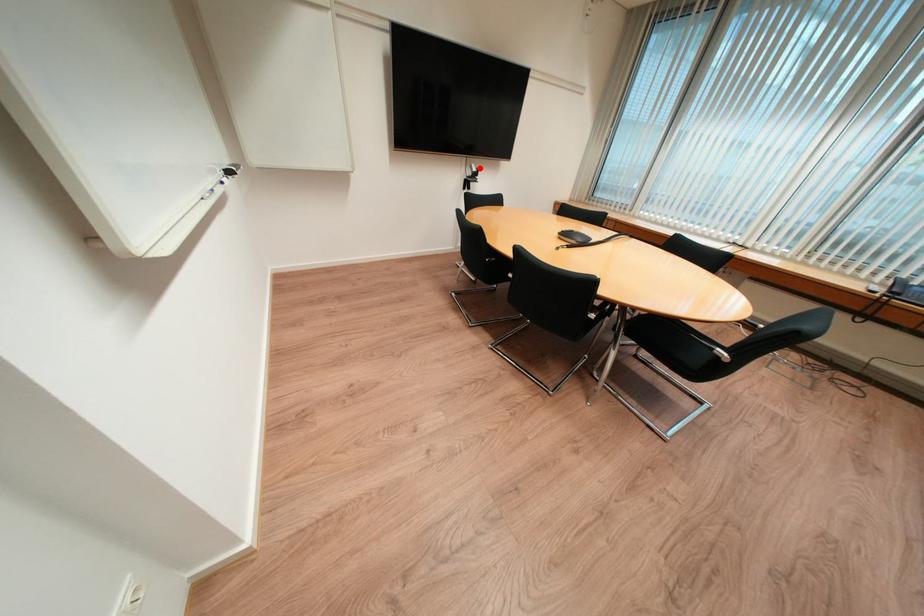
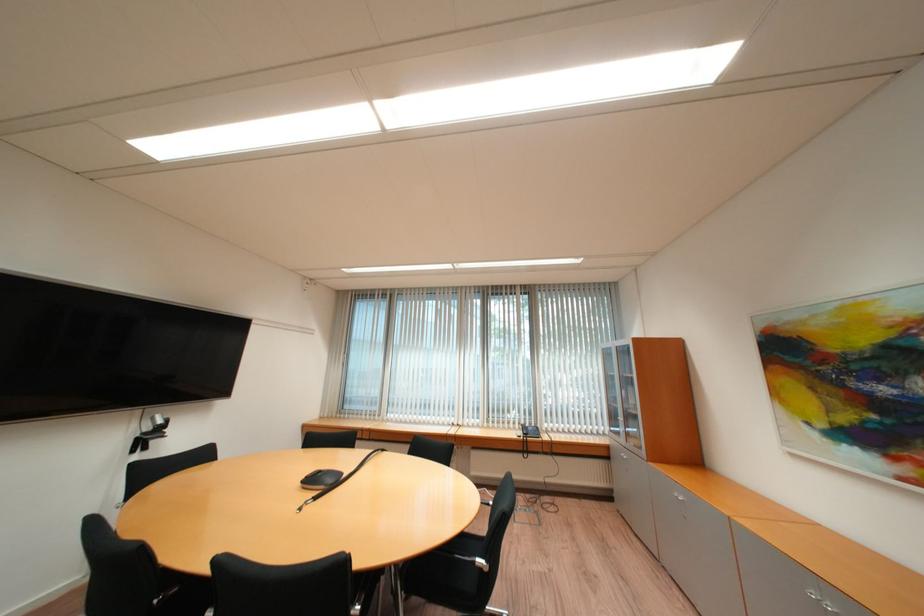
Question: I am providing you with two images of the same scene from different viewpoints. A red point is shown in image1. For the corresponding object point in image2, is it positioned nearer or farther from the camera?

Choices:
 (A) Nearer
 (B) Farther

Answer: (B)